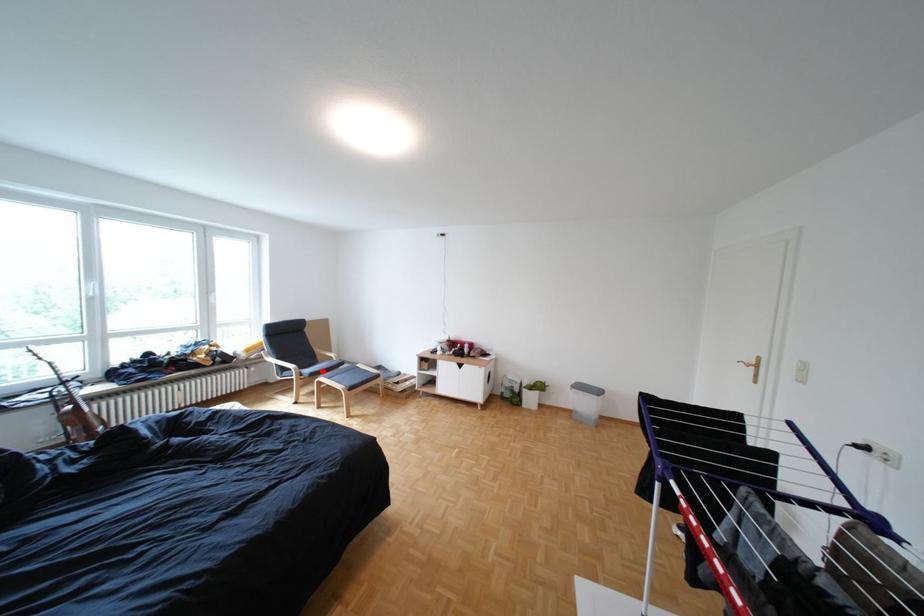
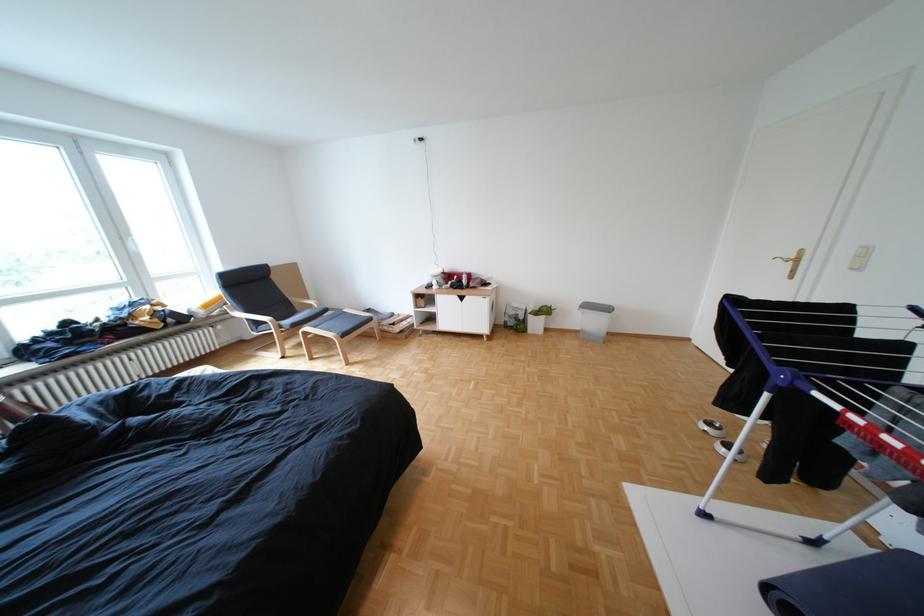
Locate, in the second image, the point that corresponds to the highlighted location in the first image.

(301, 323)